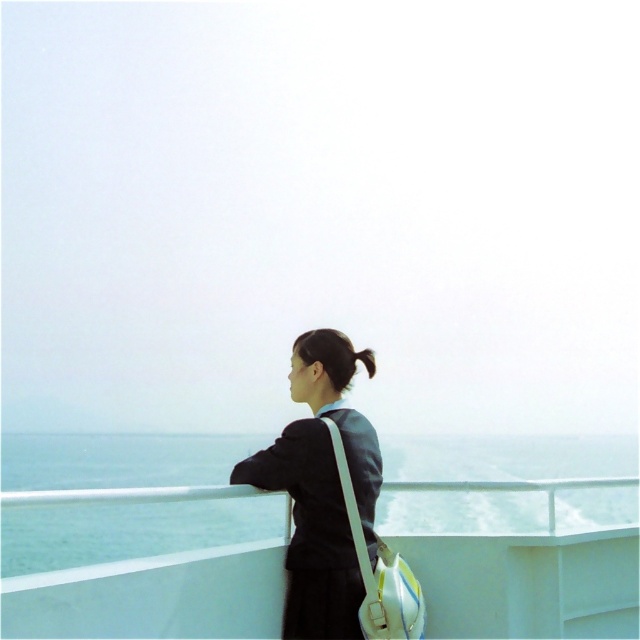
Question: Which object is farther from the camera taking this photo?

Choices:
 (A) blue water at center
 (B) matte black jacket at center

Answer: (B)

Question: Which of these objects is positioned farthest from the matte black jacket at center?

Choices:
 (A) blue water at center
 (B) black silky hair at upper center

Answer: (A)

Question: Can you confirm if blue water at center is wider than matte black jacket at center?

Choices:
 (A) yes
 (B) no

Answer: (A)

Question: Is matte black jacket at center to the right of black silky hair at upper center from the viewer's perspective?

Choices:
 (A) no
 (B) yes

Answer: (A)

Question: Which of the following is the closest to the observer?

Choices:
 (A) matte black jacket at center
 (B) blue water at center
 (C) black silky hair at upper center

Answer: (B)

Question: Does matte black jacket at center have a lesser width compared to black silky hair at upper center?

Choices:
 (A) no
 (B) yes

Answer: (A)